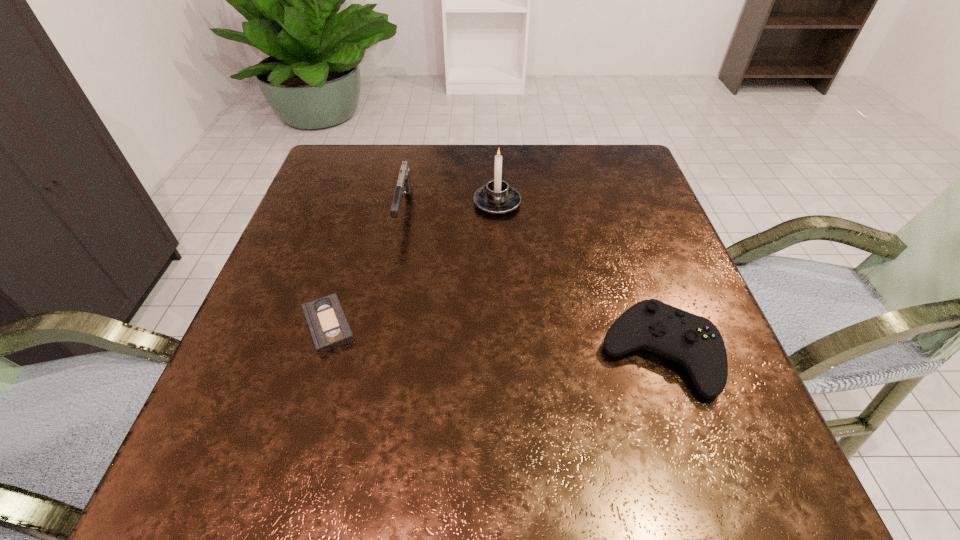
You are a GUI agent. You are given a task and a screenshot of the screen. Output one action in this format:
    pyautogui.click(x=<x>, y=<y>)
    Task: Click on the free space located 0.270m on the back of the control
    This screenshot has height=540, width=960.
    Given the screenshot: What is the action you would take?
    coord(613,220)

Find the location of `vacant space situated 0.140m on the front of the leftmost object`. vacant space situated 0.140m on the front of the leftmost object is located at coordinates (296, 434).

You are a GUI agent. You are given a task and a screenshot of the screen. Output one action in this format:
    pyautogui.click(x=<x>, y=<y>)
    Task: Click on the candle holder at the far edge
    The height and width of the screenshot is (540, 960).
    Given the screenshot: What is the action you would take?
    pyautogui.click(x=497, y=197)

This screenshot has width=960, height=540. Find the location of `gun that is positioned at the far edge`. gun that is positioned at the far edge is located at coordinates 404,184.

Where is `object that is at the left edge`? object that is at the left edge is located at coordinates (329, 328).

You are a GUI agent. You are given a task and a screenshot of the screen. Output one action in this format:
    pyautogui.click(x=<x>, y=<y>)
    Task: Click on the object that is positioned at the right edge
    
    Given the screenshot: What is the action you would take?
    pyautogui.click(x=693, y=341)

In order to click on vacant region at the far edge of the desktop in this screenshot , I will do `click(475, 159)`.

The width and height of the screenshot is (960, 540). In the image, there is a desktop. In order to click on vacant region at the left edge in this screenshot , I will do `click(312, 364)`.

I want to click on free point at the right edge, so click(682, 297).

Find the location of `free spot between the shortest object and the tallest object`. free spot between the shortest object and the tallest object is located at coordinates (413, 264).